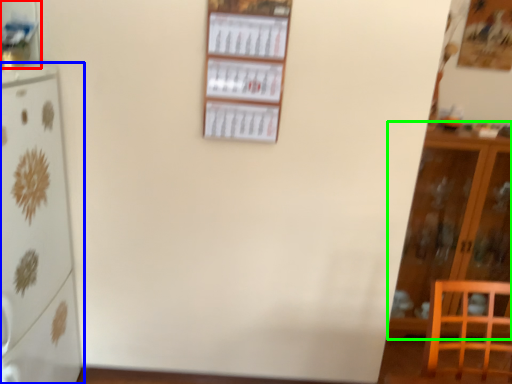
Question: Estimate the real-world distances between objects in this image. Which object is farther from shelf (highlighted by a red box), refrigerator (highlighted by a blue box) or cabinetry (highlighted by a green box)?

Choices:
 (A) refrigerator
 (B) cabinetry

Answer: (B)